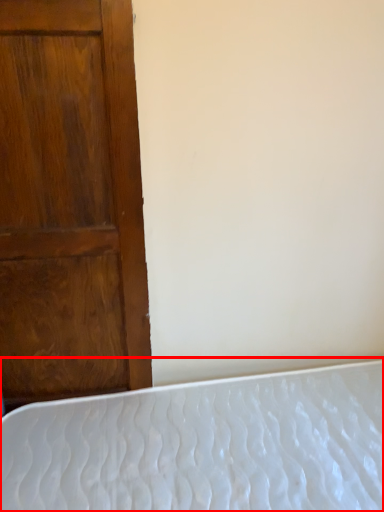
Question: From the image's perspective, where is bed (annotated by the red box) located in relation to door in the image?

Choices:
 (A) above
 (B) below

Answer: (B)